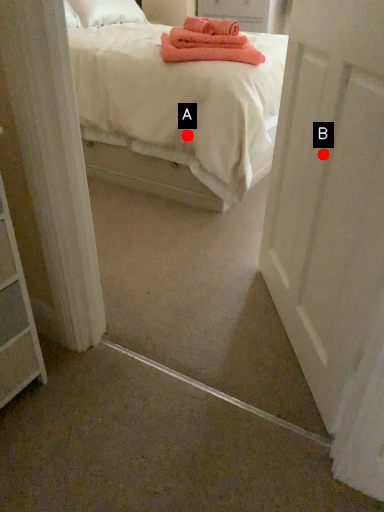
Question: Two points are circled on the image, labeled by A and B beside each circle. Among these points, which one is farthest from the camera?

Choices:
 (A) A is further
 (B) B is further

Answer: (A)